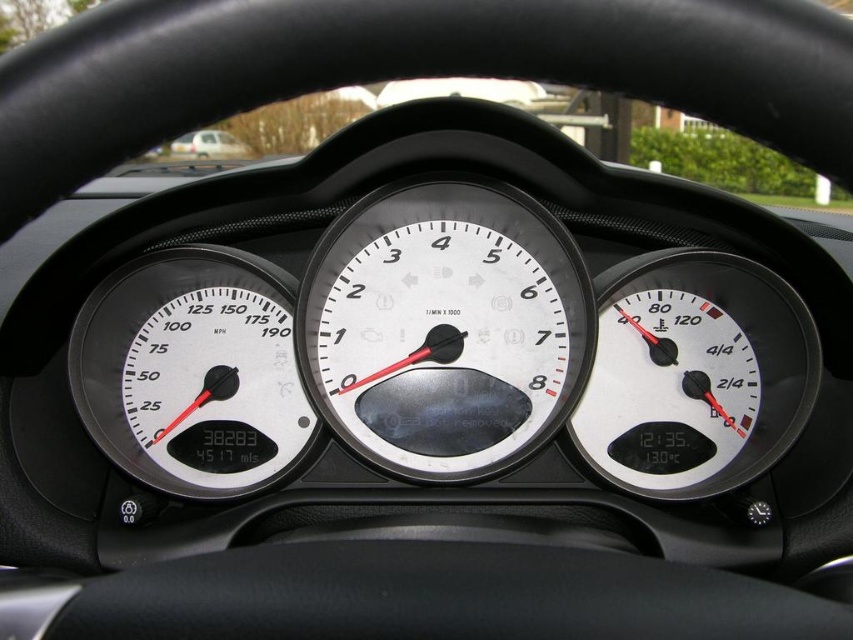
In the scene shown: You are a driver checking the dashboard of your car. You notice two objects on the dashboard. One is the white glossy speedometer at left and the other is the white matte van at upper center. Which of these two objects is taller?

The white glossy speedometer at left is taller than the white matte van at upper center according to the description.

You are a driver who wants to check the fuel level using a camera mounted on the car. The camera can capture objects within a 5 feet range. Are you able to capture the white matte fuel gauge at center right with the camera?

The white matte fuel gauge at center right and camera are 4.88 feet apart, so yes, the camera can capture the white matte fuel gauge at center right since it is within the 5 feet range.

Based on the scene description, where is the white matte tachometer at center located in terms of its 2D coordinates?

The white matte tachometer at center is located at the 2D coordinates point [444,328].